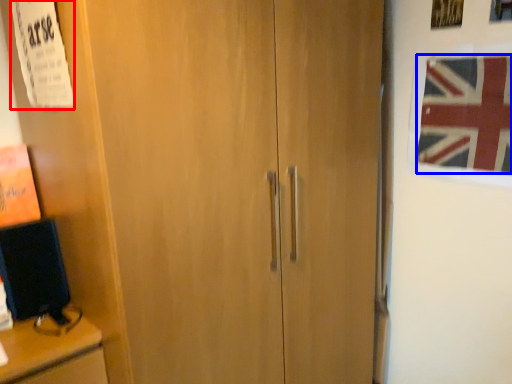
Question: Which of the following is the closest to the observer, poster (highlighted by a red box) or flag (highlighted by a blue box)?

Choices:
 (A) poster
 (B) flag

Answer: (A)